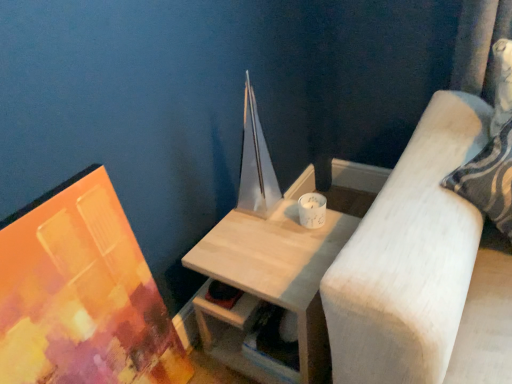
Question: Is matte acrylic painting at left positioned with its back to white ceramic candle at upper right?

Choices:
 (A) yes
 (B) no

Answer: (B)

Question: Does matte acrylic painting at left have a greater width compared to white ceramic candle at upper right?

Choices:
 (A) yes
 (B) no

Answer: (A)

Question: From a real-world perspective, is matte acrylic painting at left positioned under white ceramic candle at upper right based on gravity?

Choices:
 (A) yes
 (B) no

Answer: (A)

Question: From the image's perspective, would you say matte acrylic painting at left is positioned over white ceramic candle at upper right?

Choices:
 (A) no
 (B) yes

Answer: (A)

Question: Does matte acrylic painting at left appear on the right side of white ceramic candle at upper right?

Choices:
 (A) no
 (B) yes

Answer: (A)

Question: Is matte acrylic painting at left placed right next to white ceramic candle at upper right?

Choices:
 (A) no
 (B) yes

Answer: (A)

Question: Would you say light wood table at center is part of matte acrylic painting at left's contents?

Choices:
 (A) yes
 (B) no

Answer: (B)

Question: From a real-world perspective, is matte acrylic painting at left located higher than light wood table at center?

Choices:
 (A) no
 (B) yes

Answer: (B)

Question: Could you tell me if matte acrylic painting at left is turned towards light wood table at center?

Choices:
 (A) yes
 (B) no

Answer: (B)

Question: Considering the relative positions of matte acrylic painting at left and light wood table at center in the image provided, is matte acrylic painting at left to the right of light wood table at center from the viewer's perspective?

Choices:
 (A) yes
 (B) no

Answer: (B)

Question: Is matte acrylic painting at left further to the viewer compared to light wood table at center?

Choices:
 (A) no
 (B) yes

Answer: (A)

Question: Considering the relative sizes of matte acrylic painting at left and light wood table at center in the image provided, is matte acrylic painting at left shorter than light wood table at center?

Choices:
 (A) no
 (B) yes

Answer: (A)

Question: Could you tell me if light wood table at center is turned towards white ceramic candle at upper right?

Choices:
 (A) no
 (B) yes

Answer: (A)